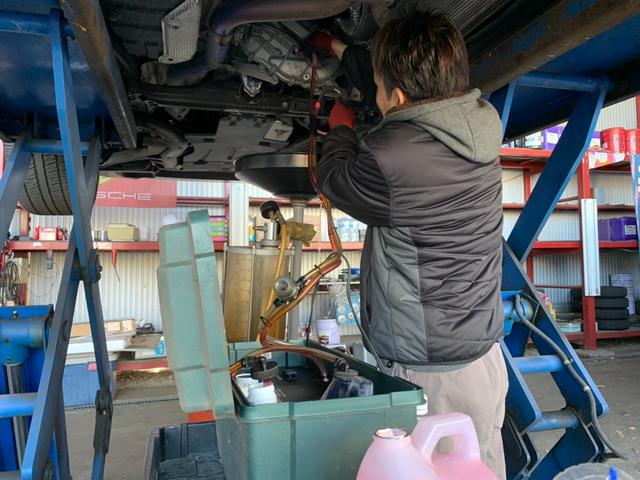
This screenshot has width=640, height=480. I want to click on blue shelving/objects, so click(x=620, y=68), click(x=555, y=69), click(x=555, y=170), click(x=518, y=278), click(x=546, y=363), click(x=564, y=452), click(x=38, y=455), click(x=56, y=357), click(x=73, y=147), click(x=33, y=40).